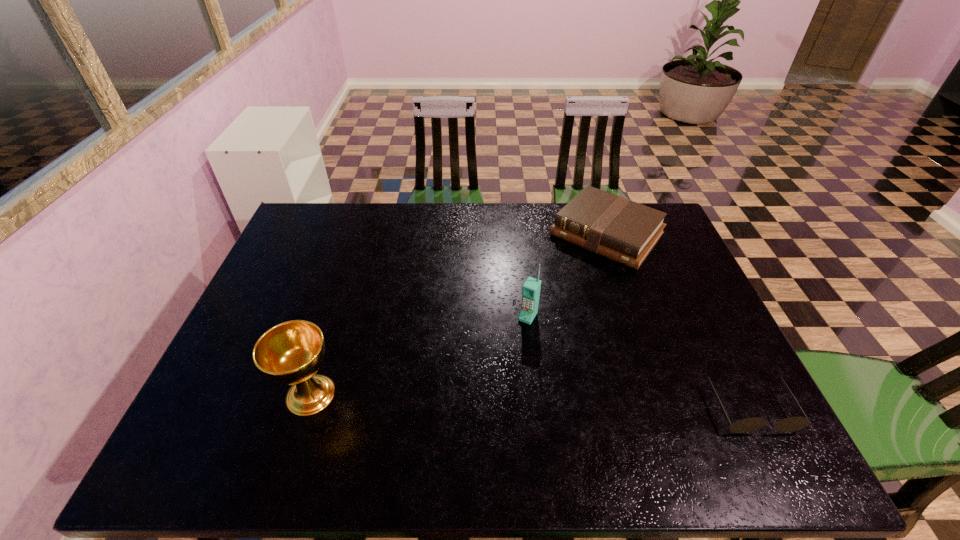
This screenshot has width=960, height=540. I want to click on free space between the shortest object and the third tallest object, so click(679, 321).

You are a GUI agent. You are given a task and a screenshot of the screen. Output one action in this format:
    pyautogui.click(x=<x>, y=<y>)
    Task: Click on the unoccupied position between the cellular telephone and the sunglasses
    
    Given the screenshot: What is the action you would take?
    pyautogui.click(x=639, y=362)

This screenshot has height=540, width=960. What are the coordinates of `vacant region between the second farthest object and the leftmost object` in the screenshot? It's located at (420, 355).

Where is `unoccupied area between the shortest object and the leftmost object`? This screenshot has width=960, height=540. unoccupied area between the shortest object and the leftmost object is located at coordinates (530, 401).

The height and width of the screenshot is (540, 960). I want to click on vacant space in between the farthest object and the cellular telephone, so click(x=567, y=275).

Find the location of a particular element. This screenshot has width=960, height=540. vacant space in between the third object from right to left and the sunglasses is located at coordinates (639, 362).

Identify the location of unoccupied area between the farthest object and the sunglasses. (679, 321).

I want to click on object that is the third closest to the chalice, so click(x=791, y=424).

What are the coordinates of `object that can be found as the third closest to the shortest object` in the screenshot? It's located at (290, 353).

Identify the location of free region that satisfies the following two spatial constraints: 1. on the back side of the chalice; 2. on the left side of the farthest object. Image resolution: width=960 pixels, height=540 pixels. (362, 234).